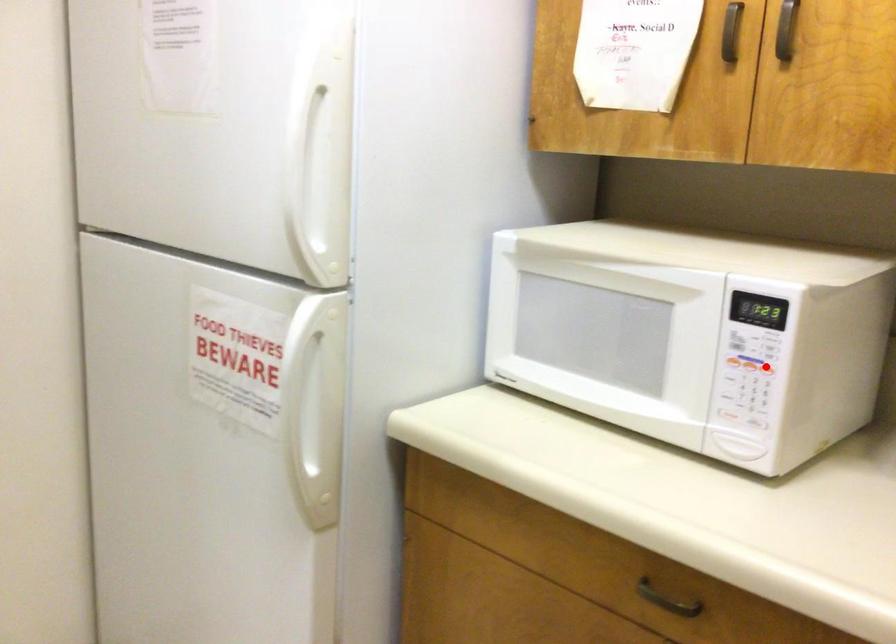
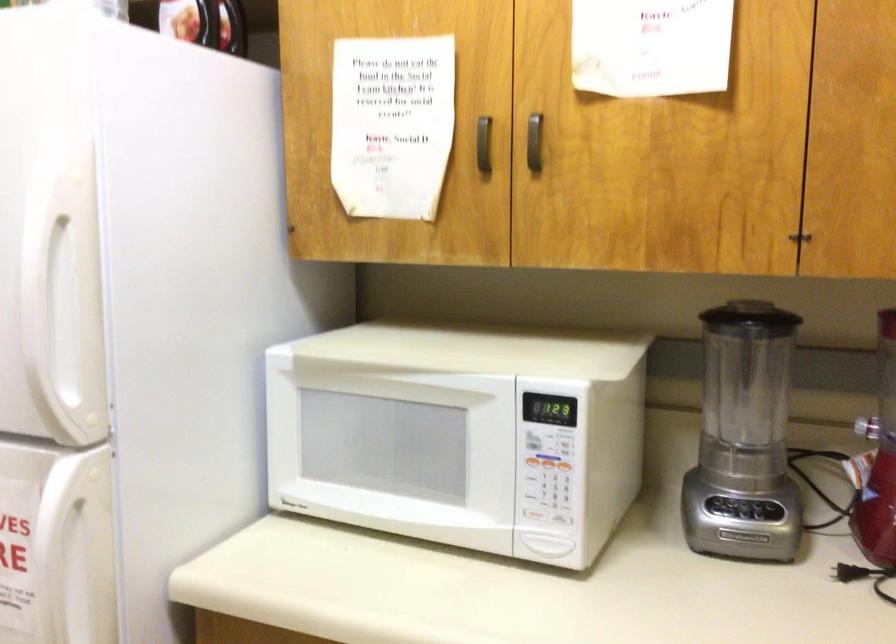
Question: I am providing you with two images of the same scene from different viewpoints. A red point is marked on the first image. Can you still see the location of the red point in image 2?

Choices:
 (A) Yes
 (B) No

Answer: (A)